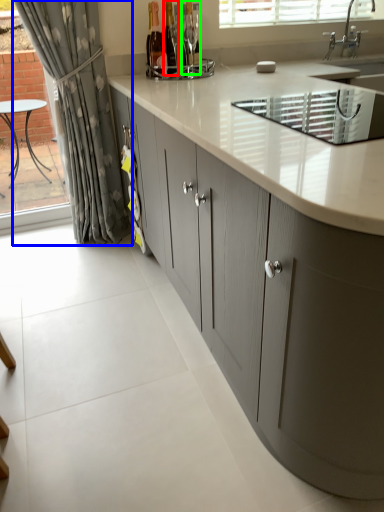
Question: Which object is positioned closest to bottle (highlighted by a red box)? Select from curtain (highlighted by a blue box) and bottle (highlighted by a green box).

Choices:
 (A) curtain
 (B) bottle

Answer: (B)